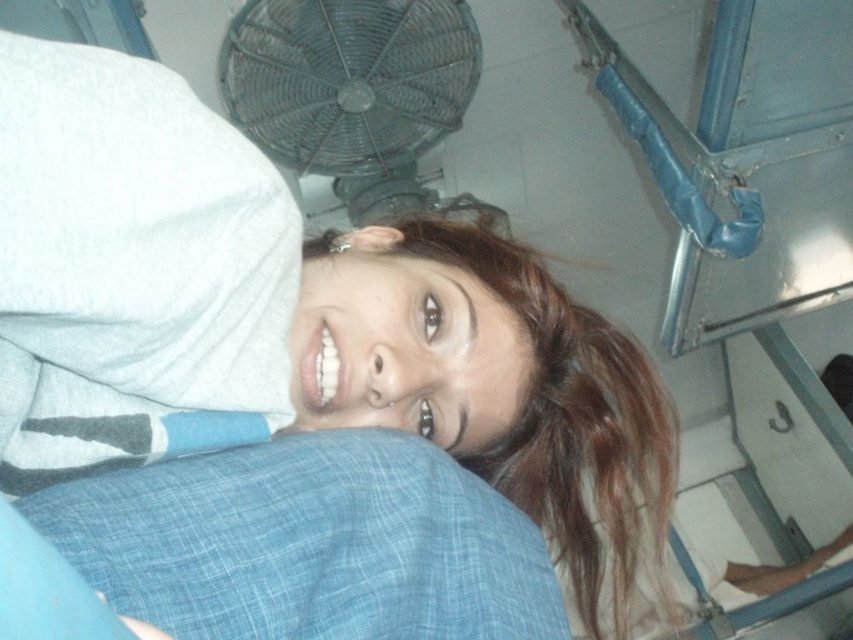
You are a maintenance worker checking the room. You see the smooth brown hair at center and the metallic wire mesh fan at upper center. Is the fan positioned above the hair?

Yes, the metallic wire mesh fan at upper center is positioned above the smooth brown hair at center since the smooth brown hair at center is located below it.

You are a safety inspector checking the room. You need to ensure that the distance between the smooth brown hair at center and the metallic wire mesh fan at upper center meets safety regulations. The regulation states that the minimum safe distance between a person and a fan should be 36 inches. Is the current distance compliant with the regulation?

The smooth brown hair at center and the metallic wire mesh fan at upper center are 33.42 inches apart from each other, which is less than the required 36 inches. Therefore, the current distance does not comply with the safety regulations.

You are a photographer setting up a shoot in this room. You need to position a light source to the left of the metallic wire mesh fan at upper center. Will this placement also be to the left of the smooth brown hair at center?

The smooth brown hair at center is to the right of the metallic wire mesh fan at upper center. Positioning the light to the left of the fan would also be to the left of the hair.